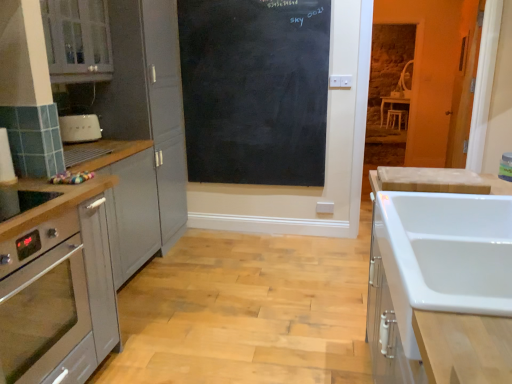
Question: From the image's perspective, is black chalkboard at center above or below matte gray cabinet at upper left, the third cabinetry when ordered from right to left?

Choices:
 (A) above
 (B) below

Answer: (B)

Question: Is black chalkboard at center bigger or smaller than matte gray cabinet at upper left, which is the 1th cabinetry in left-to-right order?

Choices:
 (A) big
 (B) small

Answer: (B)

Question: Based on their relative distances, which object is nearer to the black chalkboard at center?

Choices:
 (A) matte gray cabinet at upper left, which is the 1th cabinetry in left-to-right order
 (B) white glossy sink at right, arranged as the 3th cabinetry when viewed from the left
 (C) white marble countertop at right
 (D) white matte toaster at left, the second appliance in the bottom-to-top sequence
 (E) orange matte door at upper right

Answer: (A)

Question: Which object is the closest to the orange matte door at upper right?

Choices:
 (A) white marble countertop at right
 (B) white matte toaster at left, placed as the 1th appliance when sorted from top to bottom
 (C) satin silver cabinet at left, the second cabinetry viewed from the left
 (D) clear plastic bottle at upper right, which is the 1th appliance from front to back
 (E) white glossy sink at right, arranged as the 3th cabinetry when viewed from the left

Answer: (D)